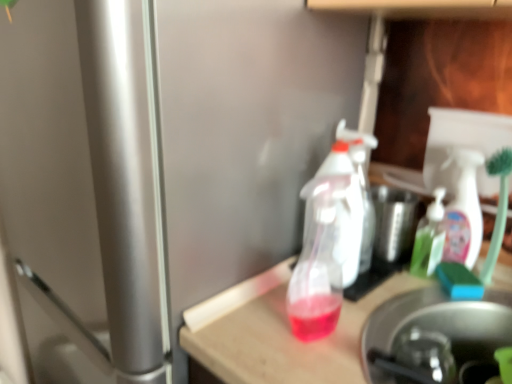
Question: Is translucent plastic spray bottle at center, the 2th bottle positioned from the back, taller or shorter than stainless steel sink at lower right?

Choices:
 (A) short
 (B) tall

Answer: (B)

Question: Considering their positions, is translucent plastic spray bottle at center, which appears as the 2th bottle when viewed from the right, located in front of or behind stainless steel sink at lower right?

Choices:
 (A) front
 (B) behind

Answer: (B)

Question: Which object is positioned farthest from the stainless steel sink at lower right?

Choices:
 (A) translucent plastic table at center
 (B) green translucent soap dispenser at center, marked as the first bottle in a back-to-front arrangement
 (C) translucent plastic spray bottle at center, which appears as the 2th bottle when viewed from the right

Answer: (C)

Question: Estimate the real-world distances between objects in this image. Which object is closer to the translucent plastic spray bottle at center, which appears as the 2th bottle when viewed from the right?

Choices:
 (A) green translucent soap dispenser at center, marked as the first bottle in a back-to-front arrangement
 (B) stainless steel sink at lower right
 (C) translucent plastic table at center

Answer: (C)